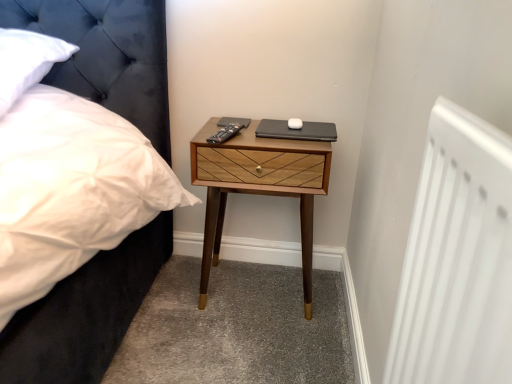
What is the approximate width of woodendrawer at center?

It is 13.39 inches.

The width and height of the screenshot is (512, 384). What do you see at coordinates (258, 186) in the screenshot?
I see `woodendrawer at center` at bounding box center [258, 186].

Locate an element on the screen. The height and width of the screenshot is (384, 512). woodendrawer at center is located at coordinates [258, 186].

Measure the distance between woodendrawer at center and camera.

woodendrawer at center is 1.18 meters from camera.

This screenshot has width=512, height=384. Identify the location of woodendrawer at center. (258, 186).